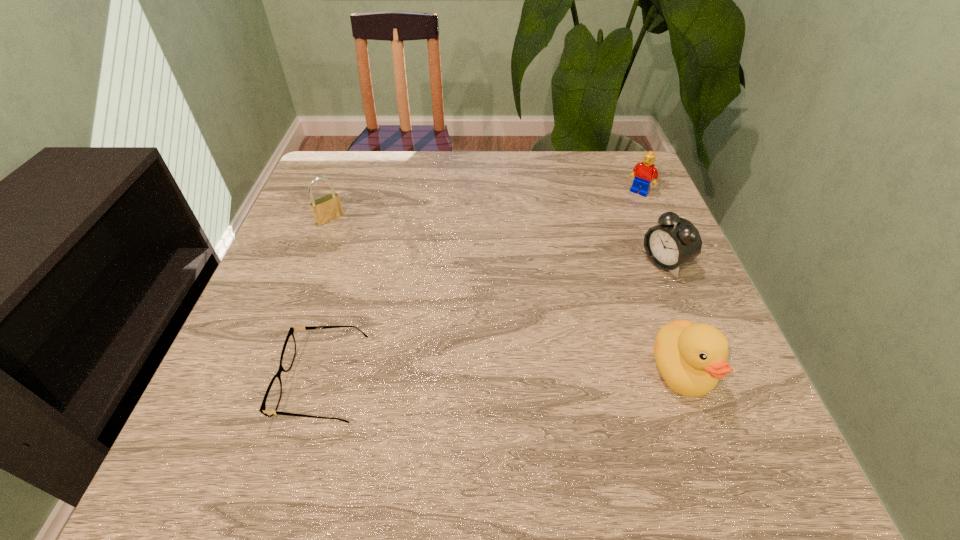
This screenshot has height=540, width=960. In order to click on spectacles in this screenshot , I will do `click(271, 400)`.

This screenshot has height=540, width=960. Find the location of `duck`. duck is located at coordinates (691, 358).

This screenshot has width=960, height=540. I want to click on the third nearest object, so click(675, 241).

Locate an element on the screen. This screenshot has height=540, width=960. Lego is located at coordinates (644, 172).

This screenshot has height=540, width=960. What are the coordinates of `padlock` in the screenshot? It's located at (325, 209).

You are a GUI agent. You are given a task and a screenshot of the screen. Output one action in this format:
    pyautogui.click(x=<x>, y=<y>)
    Task: Click on the vacant space situated on the front-facing side of the shortest object
    The width and height of the screenshot is (960, 540).
    Given the screenshot: What is the action you would take?
    (246, 382)

At what (x,y) coordinates should I click in order to perform the action: click on vacant space situated 0.090m on the front-facing side of the shortest object. Please return your answer as a coordinate pair (x, y). This screenshot has width=960, height=540. Looking at the image, I should click on (234, 382).

In order to click on vacant space situated on the front side of the alarm clock in this screenshot , I will do `click(622, 287)`.

Identify the location of free space located 0.240m on the front side of the alarm clock. This screenshot has width=960, height=540. (564, 318).

Identify the location of vacant area situated 0.330m on the front side of the alarm clock. (528, 338).